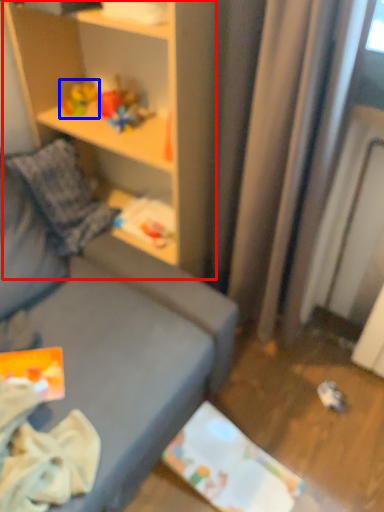
Question: Which of the following is the farthest to the observer, shelf (highlighted by a red box) or toy (highlighted by a blue box)?

Choices:
 (A) shelf
 (B) toy

Answer: (B)